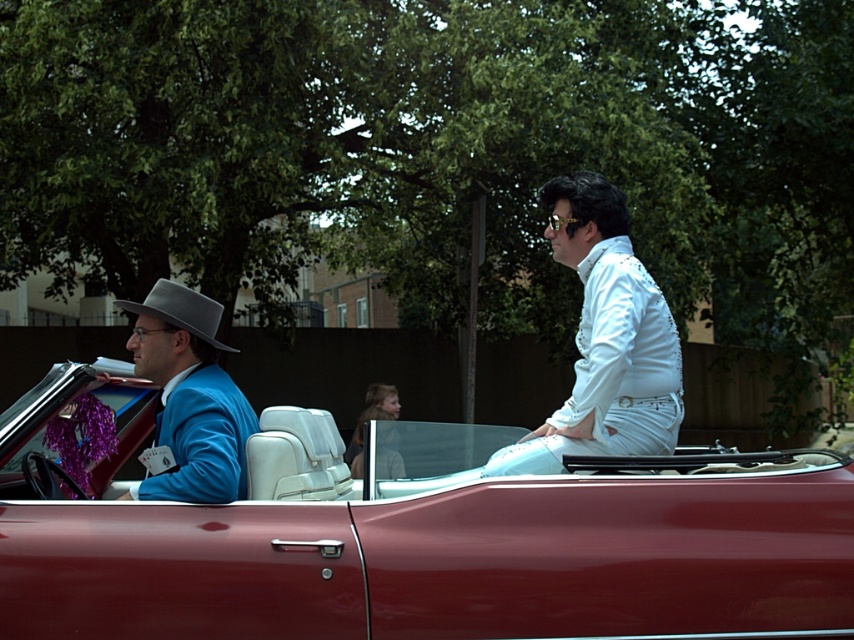
From the picture: You are trying to decide whether the shiny red car at center can fit through a narrow alleyway that is only as wide as the white sequined jacket at right. Based on the scene, can the car pass through the alleyway?

The shiny red car at center is wider than the white sequined jacket at right, so it cannot fit through an alleyway that is only as wide as the jacket.